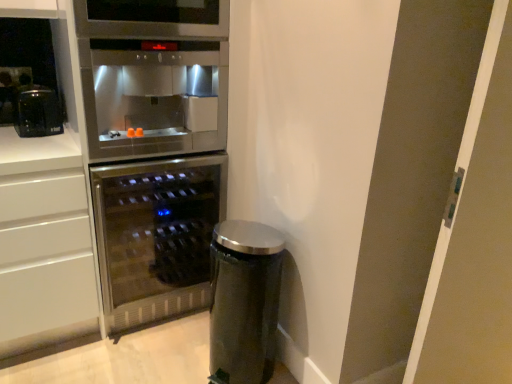
Question: Considering the relative positions of satin silver trash can at lower right and stainless steel wine cooler at center in the image provided, is satin silver trash can at lower right behind stainless steel wine cooler at center?

Choices:
 (A) no
 (B) yes

Answer: (A)

Question: From a real-world perspective, is satin silver trash can at lower right beneath stainless steel wine cooler at center?

Choices:
 (A) yes
 (B) no

Answer: (A)

Question: Is satin silver trash can at lower right smaller than stainless steel wine cooler at center?

Choices:
 (A) yes
 (B) no

Answer: (A)

Question: Are satin silver trash can at lower right and stainless steel wine cooler at center located far from each other?

Choices:
 (A) no
 (B) yes

Answer: (A)

Question: Is satin silver trash can at lower right positioned with its back to stainless steel wine cooler at center?

Choices:
 (A) no
 (B) yes

Answer: (B)

Question: In terms of height, does stainless steel wine cooler at center look taller or shorter compared to stainless steel oven at upper center?

Choices:
 (A) tall
 (B) short

Answer: (A)

Question: Is stainless steel wine cooler at center wider or thinner than stainless steel oven at upper center?

Choices:
 (A) wide
 (B) thin

Answer: (A)

Question: Visually, is stainless steel wine cooler at center positioned to the left or to the right of stainless steel oven at upper center?

Choices:
 (A) left
 (B) right

Answer: (A)

Question: Is point (138, 178) closer or farther from the camera than point (163, 72)?

Choices:
 (A) closer
 (B) farther

Answer: (B)

Question: Do you think stainless steel oven at upper center is within transparent glass door at right, or outside of it?

Choices:
 (A) inside
 (B) outside

Answer: (B)

Question: In terms of width, does stainless steel oven at upper center look wider or thinner when compared to transparent glass door at right?

Choices:
 (A) wide
 (B) thin

Answer: (A)

Question: From the image's perspective, relative to transparent glass door at right, is stainless steel oven at upper center above or below?

Choices:
 (A) above
 (B) below

Answer: (A)

Question: Does point (93, 72) appear closer or farther from the camera than point (504, 309)?

Choices:
 (A) closer
 (B) farther

Answer: (B)

Question: In terms of size, does satin silver trash can at lower right appear bigger or smaller than matte black coffee maker at upper left?

Choices:
 (A) big
 (B) small

Answer: (A)

Question: Is satin silver trash can at lower right in front of or behind matte black coffee maker at upper left in the image?

Choices:
 (A) front
 (B) behind

Answer: (A)